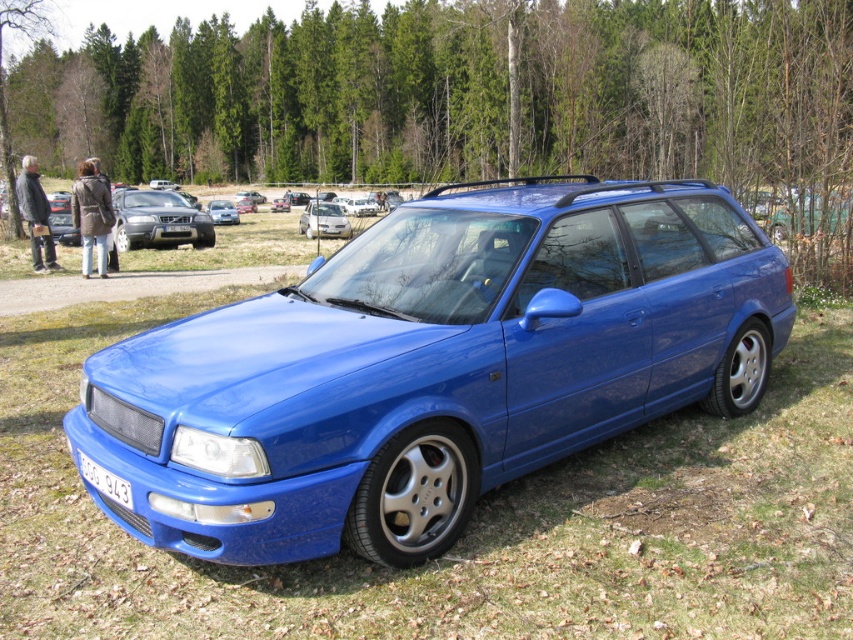
Who is shorter, white plastic license plate at lower center or blue metallic hatchback at center?

white plastic license plate at lower center

Between point (91, 474) and point (238, 214), which one is positioned in front?

Point (91, 474) is in front.

What are the coordinates of `white plastic license plate at lower center` in the screenshot? It's located at (103, 481).

Is green grass at center smaller than blue metallic hatchback at center?

Yes.

I want to click on green grass at center, so click(469, 524).

Is blue metallic hatchback at center further to camera compared to white plastic license plate at center?

Yes, it is behind white plastic license plate at center.

Who is taller, blue metallic hatchback at center or white plastic license plate at center?

Standing taller between the two is blue metallic hatchback at center.

Where is `blue metallic hatchback at center`? blue metallic hatchback at center is located at coordinates (222, 211).